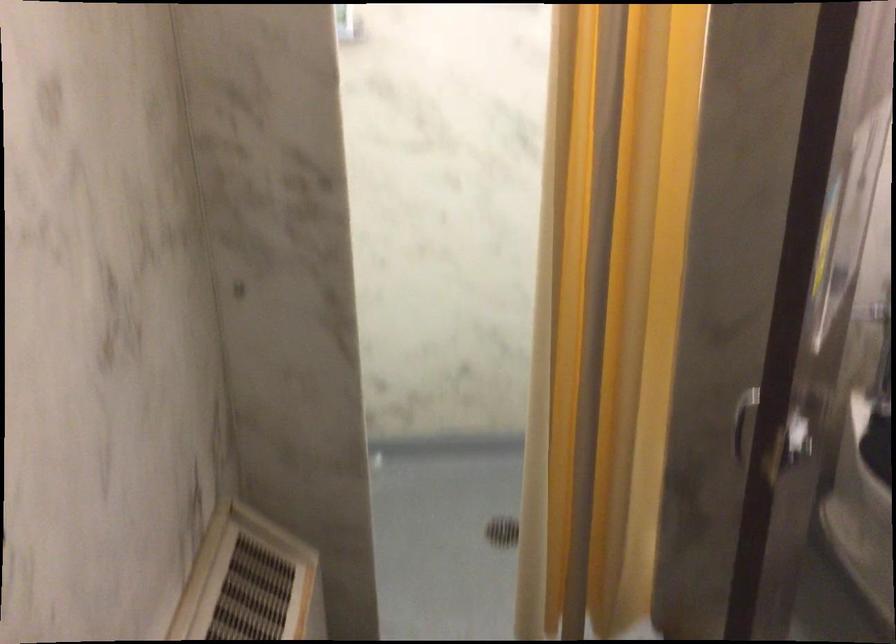
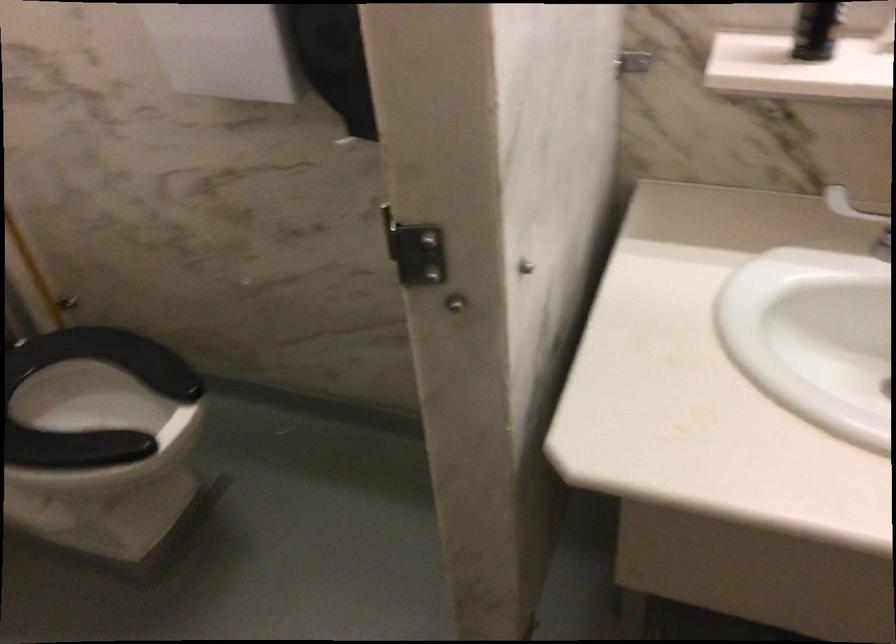
The images are taken continuously from a first-person perspective. In which direction is your viewpoint rotating?

The rotation direction of the camera is right-down.